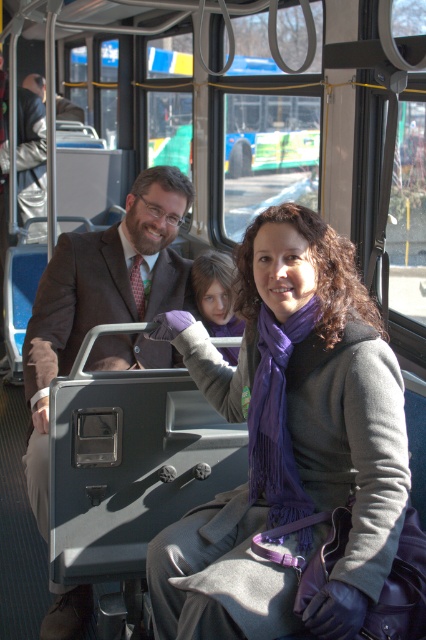
Based on the photo, can you confirm if purple soft scarf at center is positioned above matte brown suit at center?

No.

Is point (394, 467) farther from camera compared to point (89, 250)?

No, (394, 467) is closer to viewer.

The width and height of the screenshot is (426, 640). What are the coordinates of `purple soft scarf at center` in the screenshot? It's located at (288, 442).